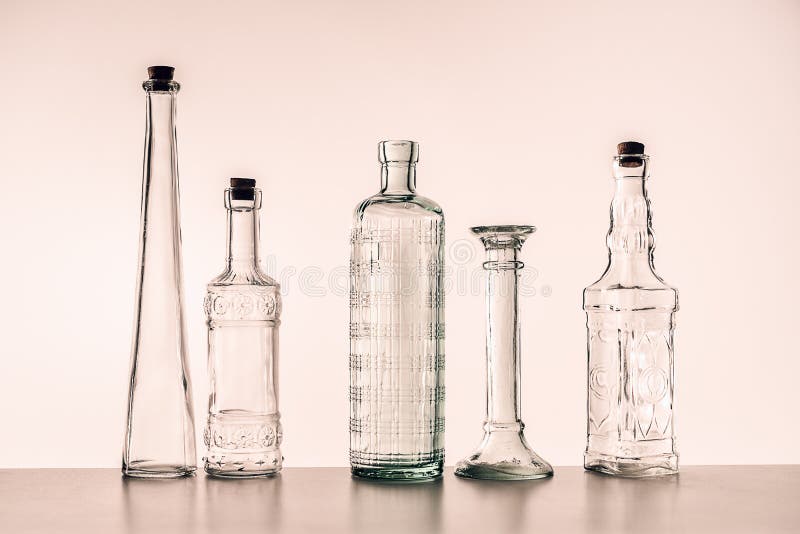
Find the location of a particular element. corks is located at coordinates point(626,146), point(250,182), point(166,68).